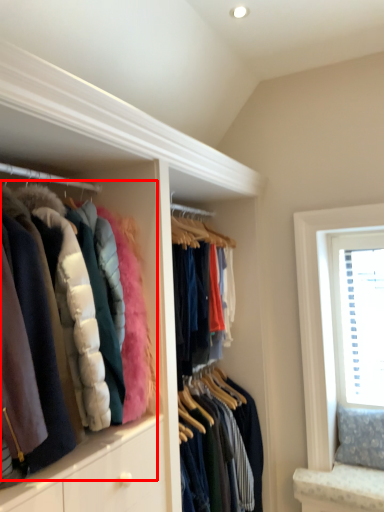
Question: Considering the relative positions of jacket (annotated by the red box) and window in the image provided, where is jacket (annotated by the red box) located with respect to the staircase?

Choices:
 (A) right
 (B) left

Answer: (B)